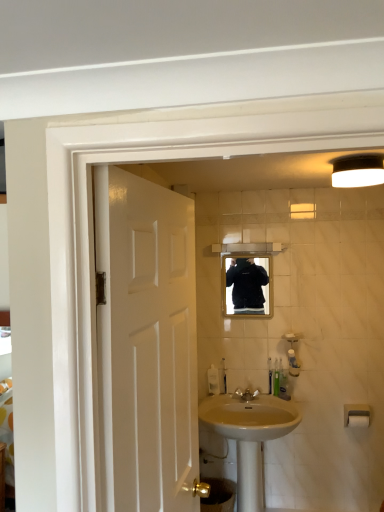
Question: From a real-world perspective, is white glossy door at left located higher than translucent plastic bottle at lower center, placed as the second toiletry when sorted from right to left?

Choices:
 (A) no
 (B) yes

Answer: (B)

Question: Is white glossy door at left not inside translucent plastic bottle at lower center, placed as the second toiletry when sorted from right to left?

Choices:
 (A) yes
 (B) no

Answer: (A)

Question: Does white glossy door at left touch translucent plastic bottle at lower center, placed as the second toiletry when sorted from right to left?

Choices:
 (A) no
 (B) yes

Answer: (A)

Question: Considering the relative positions of white glossy door at left and translucent plastic bottle at lower center, placed as the second toiletry when sorted from right to left, in the image provided, is white glossy door at left behind translucent plastic bottle at lower center, placed as the second toiletry when sorted from right to left,?

Choices:
 (A) no
 (B) yes

Answer: (A)

Question: From a real-world perspective, is white glossy door at left positioned under translucent plastic bottle at lower center, placed as the second toiletry when sorted from right to left, based on gravity?

Choices:
 (A) yes
 (B) no

Answer: (B)

Question: Do you think white matte light fixture at upper right is within polished brass faucet at sink center, or outside of it?

Choices:
 (A) inside
 (B) outside

Answer: (B)

Question: In terms of width, does white matte light fixture at upper right look wider or thinner when compared to polished brass faucet at sink center?

Choices:
 (A) thin
 (B) wide

Answer: (B)

Question: Relative to polished brass faucet at sink center, is white matte light fixture at upper right in front or behind?

Choices:
 (A) front
 (B) behind

Answer: (A)

Question: From their relative heights in the image, would you say white matte light fixture at upper right is taller or shorter than polished brass faucet at sink center?

Choices:
 (A) short
 (B) tall

Answer: (B)

Question: Relative to white plastic towel bar at lower right, positioned as the 1th towel bar in top-to-bottom order, is translucent plastic soap dispenser at sink in front or behind?

Choices:
 (A) front
 (B) behind

Answer: (B)

Question: Is point (218, 390) closer or farther from the camera than point (354, 421)?

Choices:
 (A) closer
 (B) farther

Answer: (B)

Question: Is translucent plastic soap dispenser at sink wider or thinner than white plastic towel bar at lower right, which is counted as the second towel bar, starting from the bottom?

Choices:
 (A) wide
 (B) thin

Answer: (B)

Question: From a real-world perspective, relative to white plastic towel bar at lower right, positioned as the 1th towel bar in top-to-bottom order, is translucent plastic soap dispenser at sink vertically above or below?

Choices:
 (A) below
 (B) above

Answer: (B)

Question: Would you say polished brass faucet at sink center is to the left or to the right of matte black mirror at center in the picture?

Choices:
 (A) left
 (B) right

Answer: (A)

Question: Considering the positions of polished brass faucet at sink center and matte black mirror at center in the image, is polished brass faucet at sink center bigger or smaller than matte black mirror at center?

Choices:
 (A) big
 (B) small

Answer: (B)